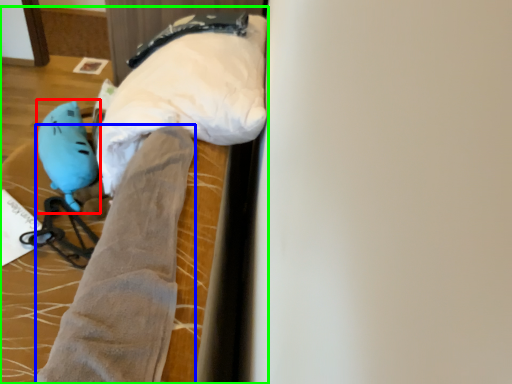
Question: Considering the real-world distances, which object is closest to toy (highlighted by a red box)? tight (highlighted by a blue box) or bed (highlighted by a green box).

Choices:
 (A) tight
 (B) bed

Answer: (B)